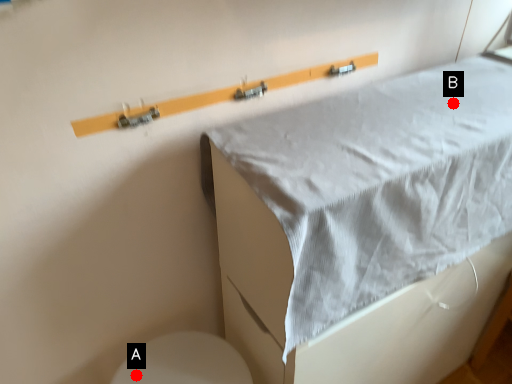
Question: Two points are circled on the image, labeled by A and B beside each circle. Which point is farther to the camera?

Choices:
 (A) A is further
 (B) B is further

Answer: (A)